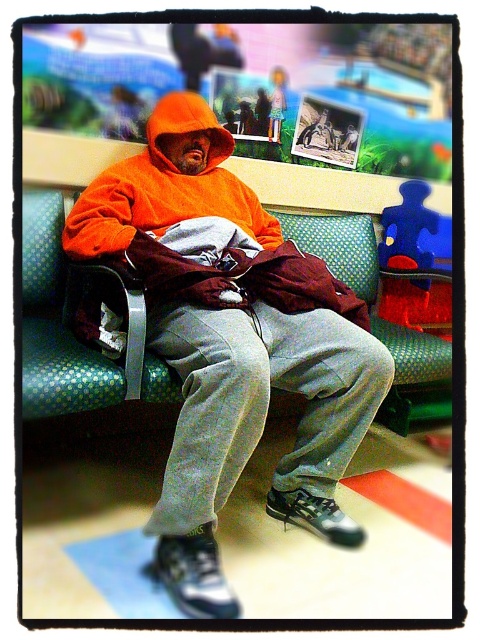
Question: Is orange fleece hoodie at center closer to camera compared to green dotted fabric bench at center?

Choices:
 (A) yes
 (B) no

Answer: (A)

Question: Which point is closer to the camera taking this photo?

Choices:
 (A) (310, 353)
 (B) (423, 356)

Answer: (A)

Question: Which point is closer to the camera taking this photo?

Choices:
 (A) (445, 362)
 (B) (317, 268)

Answer: (B)

Question: Is orange fleece hoodie at center bigger than green dotted fabric bench at center?

Choices:
 (A) yes
 (B) no

Answer: (A)

Question: Where is orange fleece hoodie at center located in relation to green dotted fabric bench at center in the image?

Choices:
 (A) right
 (B) left

Answer: (B)

Question: Which point appears closest to the camera in this image?

Choices:
 (A) (239, 205)
 (B) (55, 260)

Answer: (B)